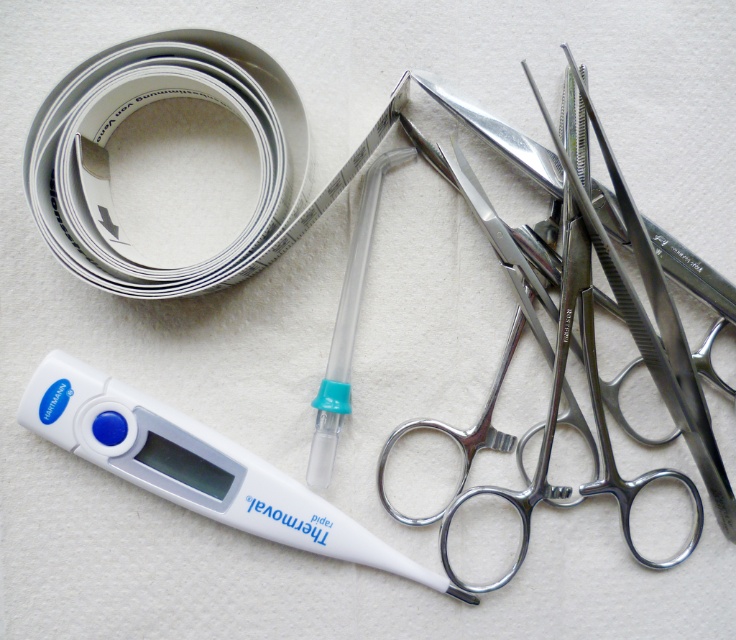
Question: Is white paper tape at upper left to the left of white plastic thermometer at lower left from the viewer's perspective?

Choices:
 (A) yes
 (B) no

Answer: (A)

Question: Which of the following is the closest to the observer?

Choices:
 (A) (127, 61)
 (B) (219, 518)

Answer: (A)

Question: Is white paper tape at upper left positioned behind white plastic thermometer at lower left?

Choices:
 (A) yes
 (B) no

Answer: (B)

Question: Does white paper tape at upper left have a lesser width compared to white plastic thermometer at lower left?

Choices:
 (A) yes
 (B) no

Answer: (A)